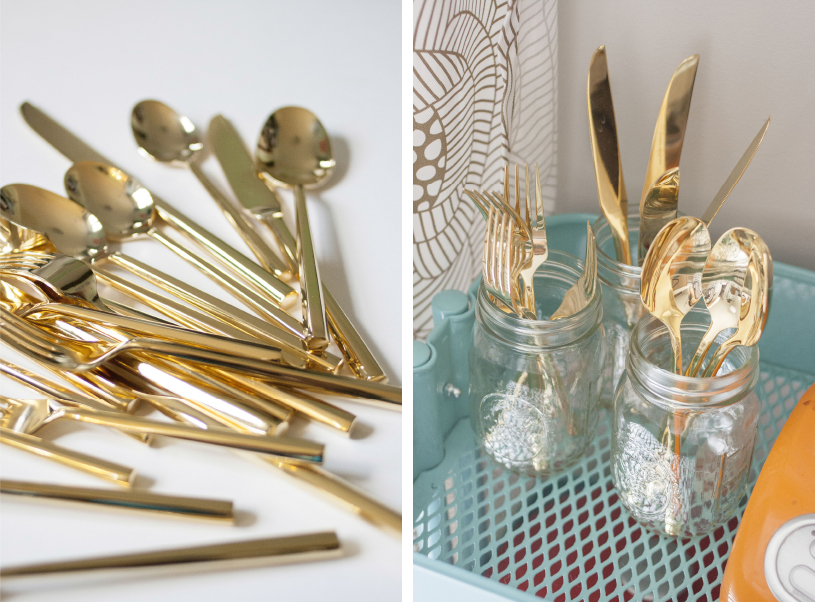
Locate an element on the screen. Image resolution: width=815 pixels, height=603 pixels. table cloth is located at coordinates (163, 55), (314, 584).